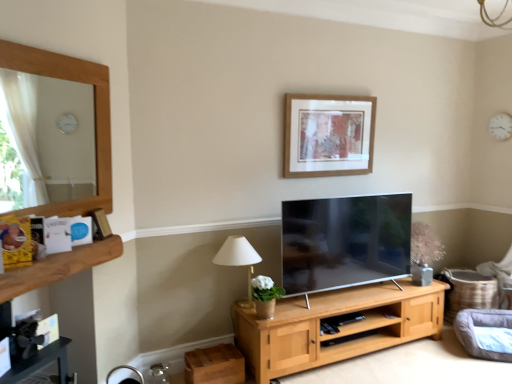
Question: Are brushed metal fireplace at lower left and wooden picture frame at upper center far apart?

Choices:
 (A) no
 (B) yes

Answer: (B)

Question: Is brushed metal fireplace at lower left turned away from wooden picture frame at upper center?

Choices:
 (A) yes
 (B) no

Answer: (B)

Question: From the image's perspective, is brushed metal fireplace at lower left above wooden picture frame at upper center?

Choices:
 (A) no
 (B) yes

Answer: (A)

Question: Could wooden picture frame at upper center be considered to be inside brushed metal fireplace at lower left?

Choices:
 (A) no
 (B) yes

Answer: (A)

Question: Can you confirm if brushed metal fireplace at lower left is wider than wooden picture frame at upper center?

Choices:
 (A) yes
 (B) no

Answer: (A)

Question: Considering the relative sizes of brushed metal fireplace at lower left and wooden picture frame at upper center in the image provided, is brushed metal fireplace at lower left shorter than wooden picture frame at upper center?

Choices:
 (A) yes
 (B) no

Answer: (B)

Question: Can you confirm if wooden picture frame at upper center is shorter than brown wooden shelf at left?

Choices:
 (A) yes
 (B) no

Answer: (B)

Question: Is wooden picture frame at upper center positioned before brown wooden shelf at left?

Choices:
 (A) no
 (B) yes

Answer: (A)

Question: Is wooden picture frame at upper center at the left side of brown wooden shelf at left?

Choices:
 (A) no
 (B) yes

Answer: (A)

Question: From a real-world perspective, is wooden picture frame at upper center located higher than brown wooden shelf at left?

Choices:
 (A) yes
 (B) no

Answer: (A)

Question: Can you confirm if wooden picture frame at upper center is taller than brown wooden shelf at left?

Choices:
 (A) yes
 (B) no

Answer: (A)

Question: From a real-world perspective, is wooden picture frame at upper center positioned under brown wooden shelf at left based on gravity?

Choices:
 (A) no
 (B) yes

Answer: (A)

Question: Does wooden picture frame at upper center have a smaller size compared to brushed metal fireplace at lower left?

Choices:
 (A) no
 (B) yes

Answer: (B)